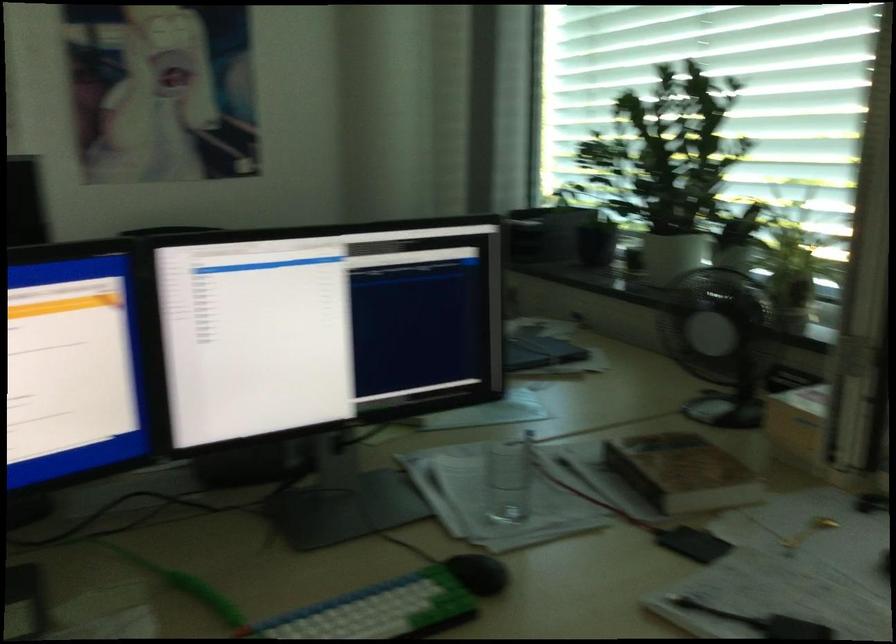
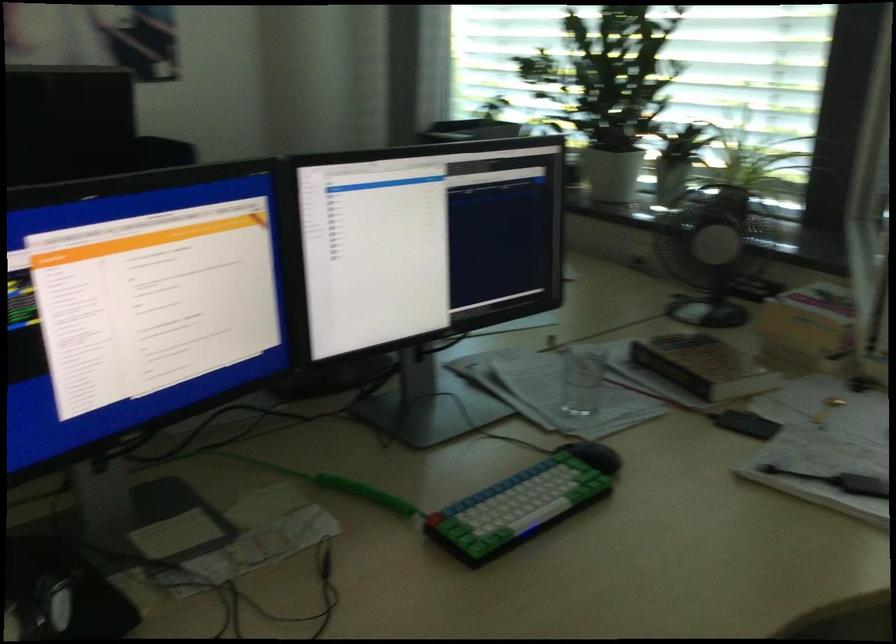
Where in the second image is the point corresponding to the point at 659,474 from the first image?

(703, 366)